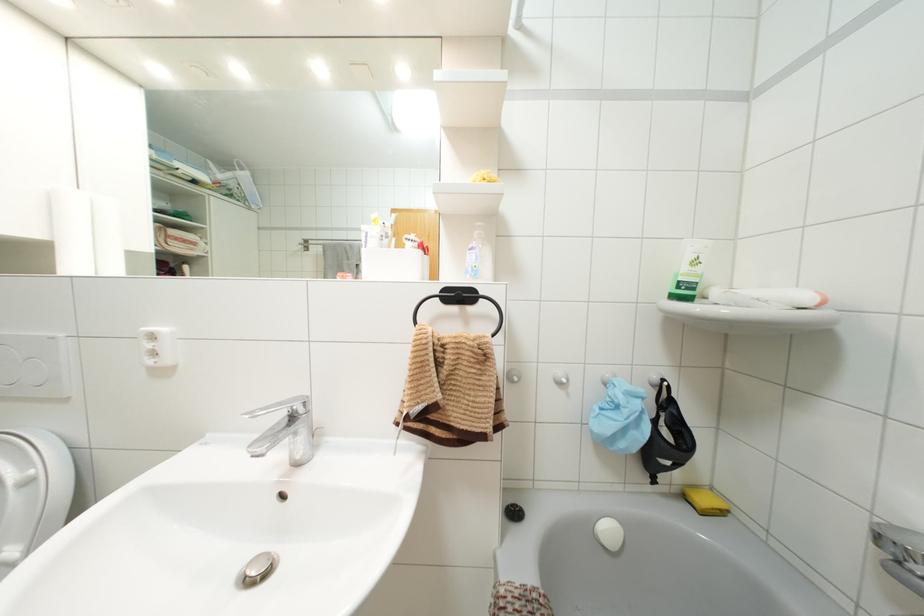
Locate an element on the screen. small flush button is located at coordinates (34, 371).